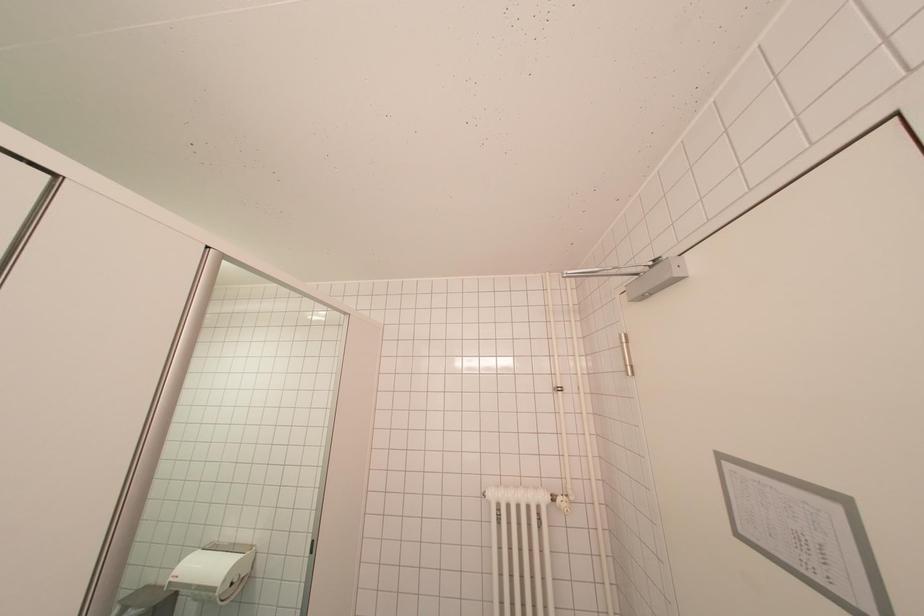
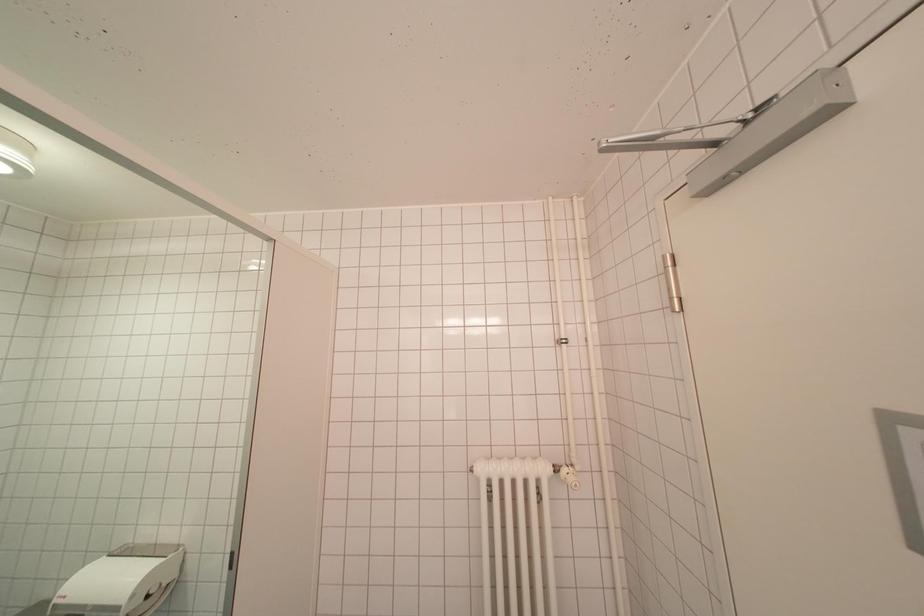
Question: The first image is from the beginning of the video and the second image is from the end. How did the camera likely rotate when shooting the video?

Choices:
 (A) Left
 (B) Right
 (C) Up
 (D) Down

Answer: (D)